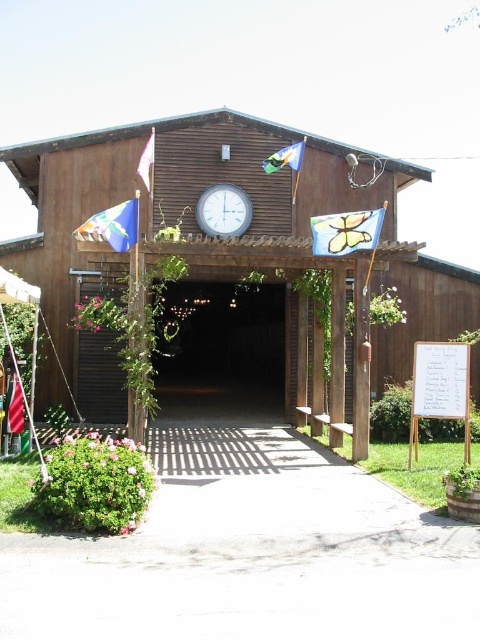
You are planning to hang a new decorative item between the white plastic clock at center and the blue fabric flag at upper center. The item you have is 15 cm wide. Considering the spacing between them, can you fit it without overlapping either?

The white plastic clock at center is wider than the blue fabric flag at upper center. However, the exact spacing between them isn not specified in the provided description. Without knowing the distance between the two objects, it is impossible to determine if the 15 cm wide item will fit without overlapping.

You are standing at the entrance of the brown wooden barn at center and want to hang a new decorative item above the entrance. Considering the butterfly fabric flag at center is already present, where should you place the new item to ensure it is above the barn but not overlapping with the flag?

The brown wooden barn at center is below the butterfly fabric flag at center, so placing the new item above the flag would ensure it is positioned above the barn without overlapping.

You are planning to hang a new decorative flag that is 1 meter wide. You see the butterfly fabric flag at center and the blue fabric flag at upper center. Which existing flag could potentially accommodate the new flag if placed next to it without overlapping?

The butterfly fabric flag at center might be wider than blue fabric flag at upper center, so the new 1 meter wide flag could potentially be placed next to the butterfly fabric flag at center since it might have more space available.